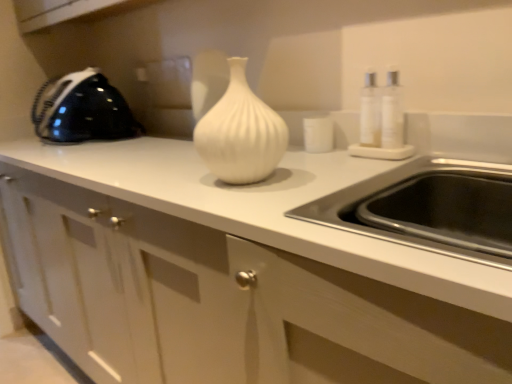
Question: Does white glossy vase at center have a greater height compared to white glossy cabinet at center?

Choices:
 (A) yes
 (B) no

Answer: (B)

Question: Can you confirm if white glossy vase at center is wider than white glossy cabinet at center?

Choices:
 (A) no
 (B) yes

Answer: (A)

Question: Is there a large distance between white glossy vase at center and white glossy cabinet at center?

Choices:
 (A) no
 (B) yes

Answer: (A)

Question: Could you tell me if white glossy vase at center is turned towards white glossy cabinet at center?

Choices:
 (A) yes
 (B) no

Answer: (B)

Question: From a real-world perspective, is white glossy vase at center physically below white glossy cabinet at center?

Choices:
 (A) no
 (B) yes

Answer: (A)

Question: Is the surface of white glossy vase at center in direct contact with white glossy cabinet at center?

Choices:
 (A) no
 (B) yes

Answer: (A)

Question: Considering the relative sizes of white glossy cabinet at center and black glossy iron at left in the image provided, is white glossy cabinet at center thinner than black glossy iron at left?

Choices:
 (A) no
 (B) yes

Answer: (A)

Question: Is black glossy iron at left at the back of white glossy cabinet at center?

Choices:
 (A) no
 (B) yes

Answer: (A)

Question: From a real-world perspective, is white glossy cabinet at center on black glossy iron at left?

Choices:
 (A) no
 (B) yes

Answer: (A)

Question: Is white glossy cabinet at center oriented towards black glossy iron at left?

Choices:
 (A) no
 (B) yes

Answer: (A)

Question: From the image's perspective, is white glossy cabinet at center under black glossy iron at left?

Choices:
 (A) no
 (B) yes

Answer: (B)

Question: Can you confirm if white glossy cabinet at center is positioned to the right of black glossy iron at left?

Choices:
 (A) yes
 (B) no

Answer: (A)

Question: Can you confirm if white glossy cabinet at center is shorter than white glossy vase at center?

Choices:
 (A) yes
 (B) no

Answer: (B)